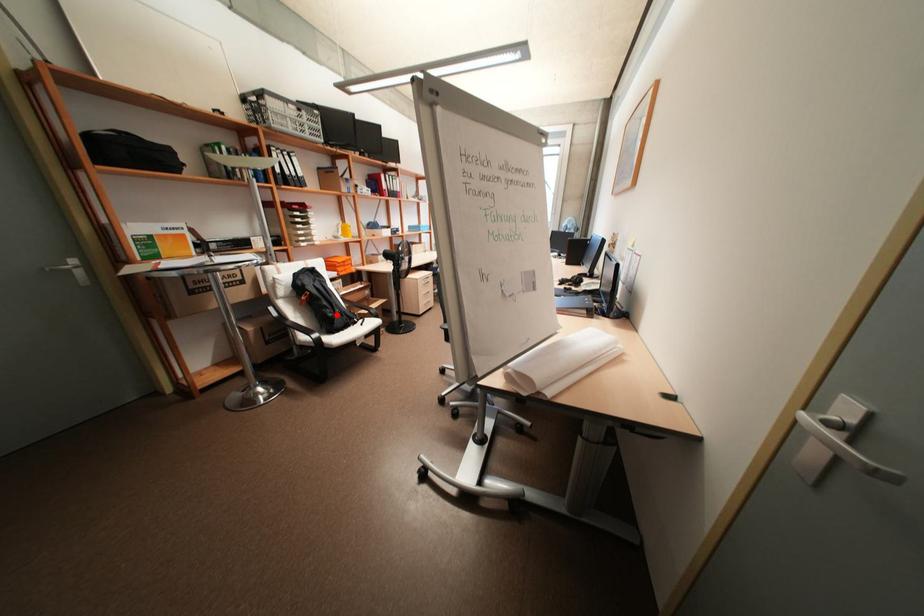
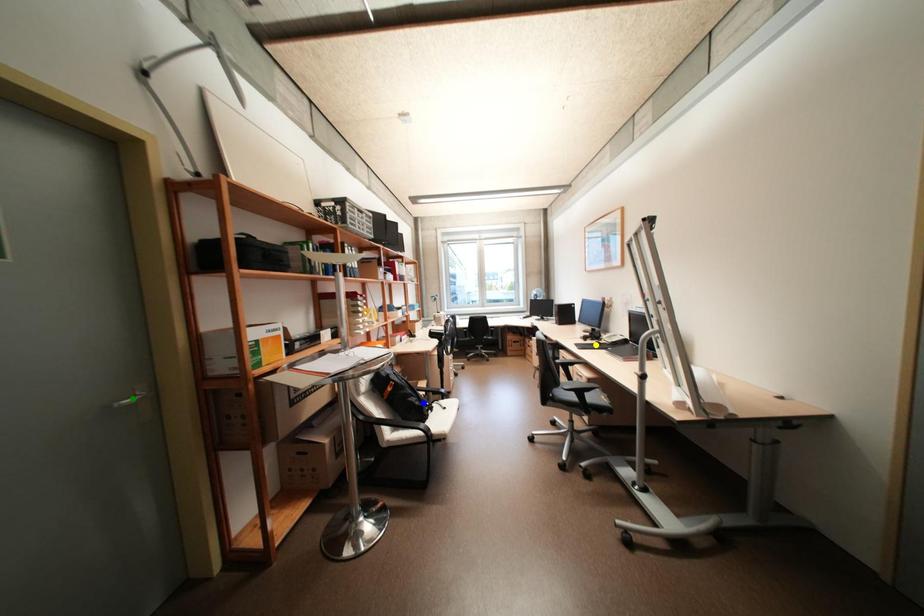
Question: I am providing you with two images of the same scene from different viewpoints. A red point is marked on the first image. You are given multiple points on the second image. Which mark in image 2 goes with the point in image 1?

Choices:
 (A) yellow point
 (B) green point
 (C) blue point

Answer: (C)